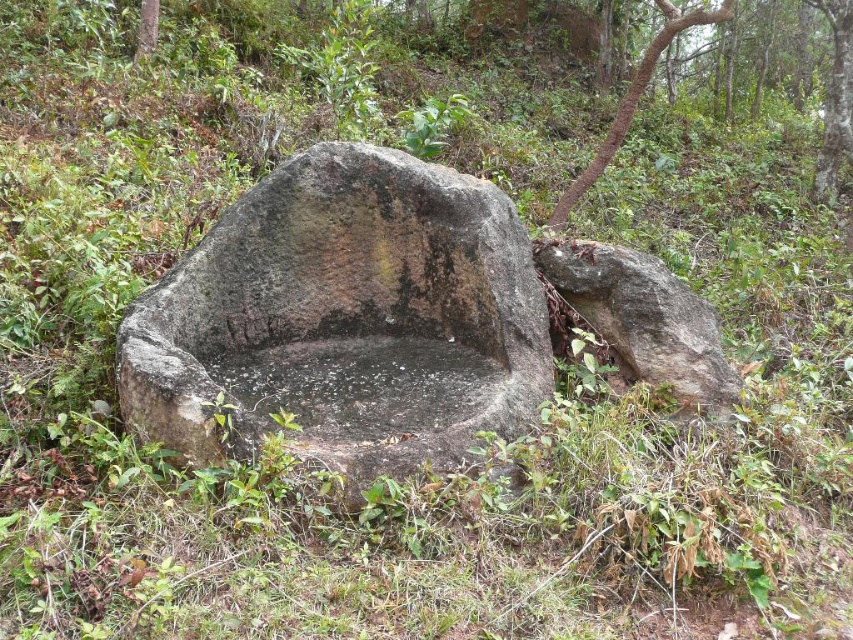
You are a hiker who wants to take a break. You see the gray rough stone at center and the brown rough bark tree at upper center. Which object is shorter and would be better for sitting?

The gray rough stone at center is shorter than the brown rough bark tree at upper center, so it would be better for sitting.

You are a hiker who wants to sit on the gray rough boulder at right. To your left, there is the gray rough stone at center. Which direction should you walk to reach the boulder?

The gray rough stone at center is to the left of the gray rough boulder at right. To reach the boulder, you should walk to the right from your current position.

You are a hiker trying to navigate through the forest. You see the gray rough boulder at right and the brown rough bark tree at upper center. Which object is positioned more to the left side of the scene?

The gray rough boulder at right is positioned to the left of the brown rough bark tree at upper center, so it is more to the left side of the scene.